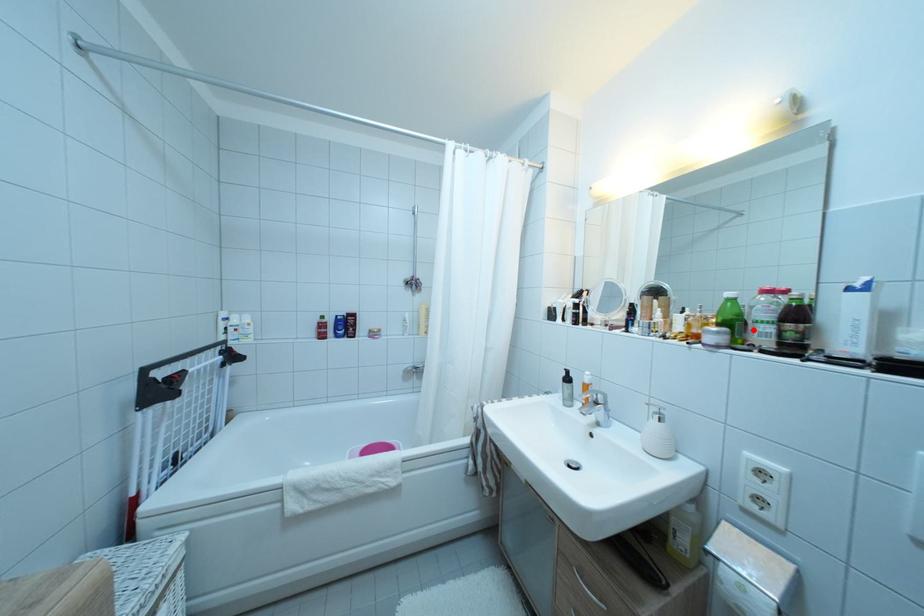
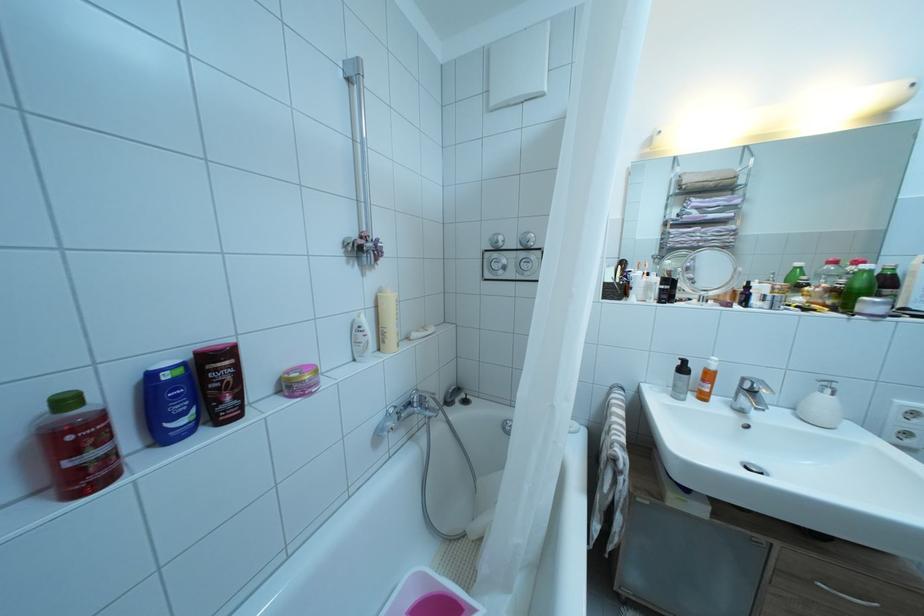
Question: I am providing you with two images of the same scene from different viewpoints. A red point is marked on the first image. Can you still see the location of the red point in image 2?

Choices:
 (A) Yes
 (B) No

Answer: (B)